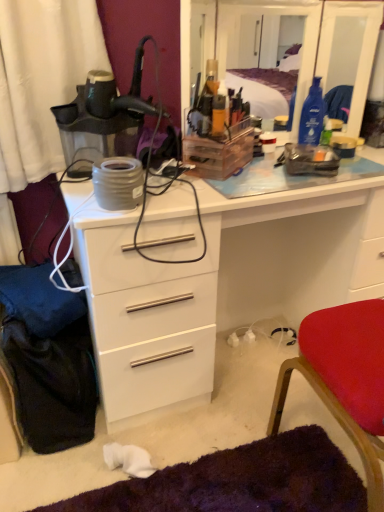
Question: Is transparent plastic mirror at upper center looking in the opposite direction of white glossy chest of drawers at center?

Choices:
 (A) no
 (B) yes

Answer: (A)

Question: Is transparent plastic mirror at upper center taller than white glossy chest of drawers at center?

Choices:
 (A) yes
 (B) no

Answer: (B)

Question: Is transparent plastic mirror at upper center aimed at white glossy chest of drawers at center?

Choices:
 (A) yes
 (B) no

Answer: (B)

Question: Does transparent plastic mirror at upper center have a greater width compared to white glossy chest of drawers at center?

Choices:
 (A) no
 (B) yes

Answer: (A)

Question: Can you confirm if transparent plastic mirror at upper center is smaller than white glossy chest of drawers at center?

Choices:
 (A) yes
 (B) no

Answer: (A)

Question: Does transparent plastic mirror at upper center appear on the left side of white glossy chest of drawers at center?

Choices:
 (A) yes
 (B) no

Answer: (B)

Question: Can you confirm if white glossy chest of drawers at center is taller than transparent plastic mirror at upper center?

Choices:
 (A) yes
 (B) no

Answer: (A)

Question: Is white glossy chest of drawers at center positioned before transparent plastic mirror at upper center?

Choices:
 (A) yes
 (B) no

Answer: (A)

Question: Does white glossy chest of drawers at center contain transparent plastic mirror at upper center?

Choices:
 (A) no
 (B) yes

Answer: (A)

Question: Could you tell me if white glossy chest of drawers at center is facing transparent plastic mirror at upper center?

Choices:
 (A) no
 (B) yes

Answer: (A)

Question: Considering the relative positions of white glossy chest of drawers at center and transparent plastic mirror at upper center in the image provided, is white glossy chest of drawers at center behind transparent plastic mirror at upper center?

Choices:
 (A) no
 (B) yes

Answer: (A)

Question: Can you confirm if white glossy chest of drawers at center is bigger than transparent plastic mirror at upper center?

Choices:
 (A) yes
 (B) no

Answer: (A)

Question: Considering the relative sizes of red fabric chair at lower right and transparent plastic mirror at upper center in the image provided, is red fabric chair at lower right shorter than transparent plastic mirror at upper center?

Choices:
 (A) no
 (B) yes

Answer: (A)